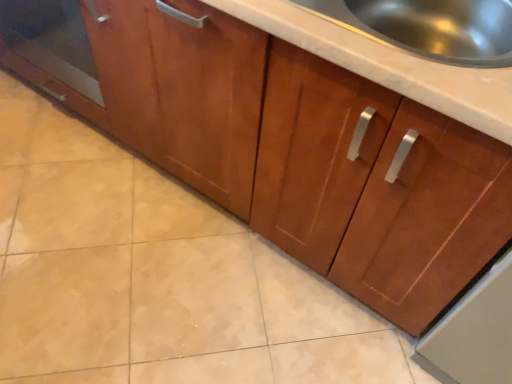
Question: Is stainless steel sink at upper right next to transparent glass door at left and touching it?

Choices:
 (A) no
 (B) yes

Answer: (A)

Question: Would you say stainless steel sink at upper right contains transparent glass door at left?

Choices:
 (A) no
 (B) yes

Answer: (A)

Question: Is stainless steel sink at upper right far away from transparent glass door at left?

Choices:
 (A) no
 (B) yes

Answer: (B)

Question: Is stainless steel sink at upper right wider than transparent glass door at left?

Choices:
 (A) no
 (B) yes

Answer: (A)

Question: Is stainless steel sink at upper right to the left of transparent glass door at left from the viewer's perspective?

Choices:
 (A) yes
 (B) no

Answer: (B)

Question: From a real-world perspective, is stainless steel sink at upper right over transparent glass door at left?

Choices:
 (A) no
 (B) yes

Answer: (B)

Question: Is transparent glass door at left oriented away from stainless steel sink at upper right?

Choices:
 (A) no
 (B) yes

Answer: (A)

Question: From a real-world perspective, is transparent glass door at left on stainless steel sink at upper right?

Choices:
 (A) yes
 (B) no

Answer: (B)

Question: Does transparent glass door at left appear on the left side of stainless steel sink at upper right?

Choices:
 (A) yes
 (B) no

Answer: (A)

Question: Considering the relative sizes of transparent glass door at left and stainless steel sink at upper right in the image provided, is transparent glass door at left smaller than stainless steel sink at upper right?

Choices:
 (A) no
 (B) yes

Answer: (A)

Question: Does transparent glass door at left come in front of stainless steel sink at upper right?

Choices:
 (A) yes
 (B) no

Answer: (B)

Question: Can you confirm if transparent glass door at left is positioned to the right of stainless steel sink at upper right?

Choices:
 (A) no
 (B) yes

Answer: (A)

Question: Based on their sizes in the image, would you say transparent glass door at left is bigger or smaller than stainless steel sink at upper right?

Choices:
 (A) big
 (B) small

Answer: (A)